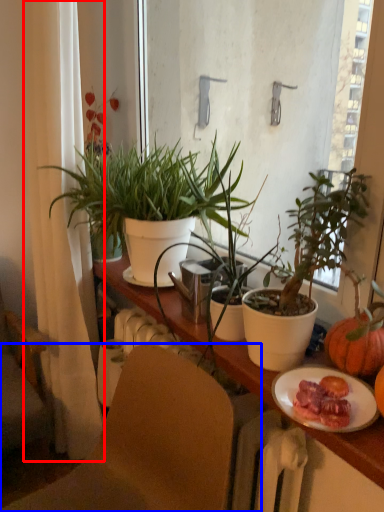
Question: Which object appears farthest to the camera in this image, curtain (highlighted by a red box) or chair (highlighted by a blue box)?

Choices:
 (A) curtain
 (B) chair

Answer: (A)